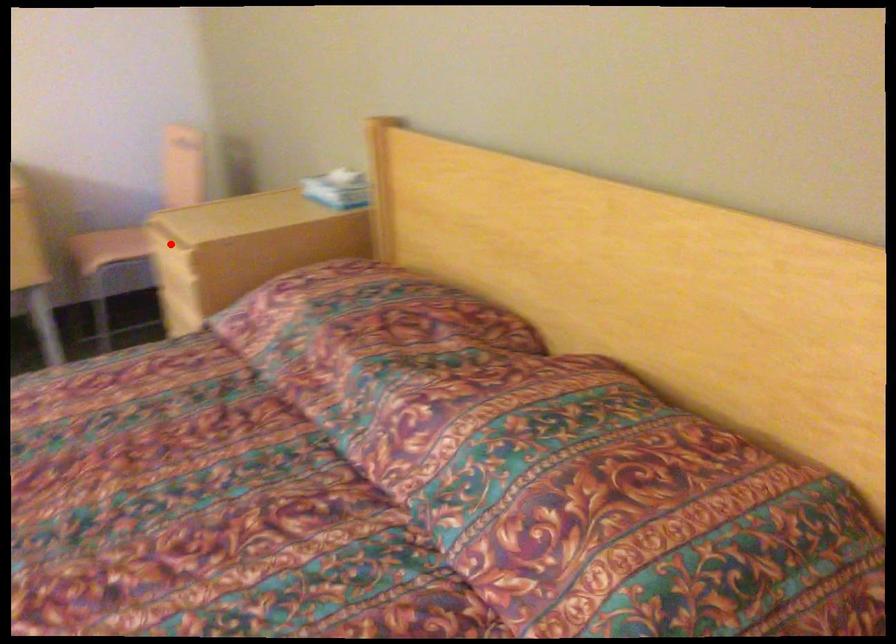
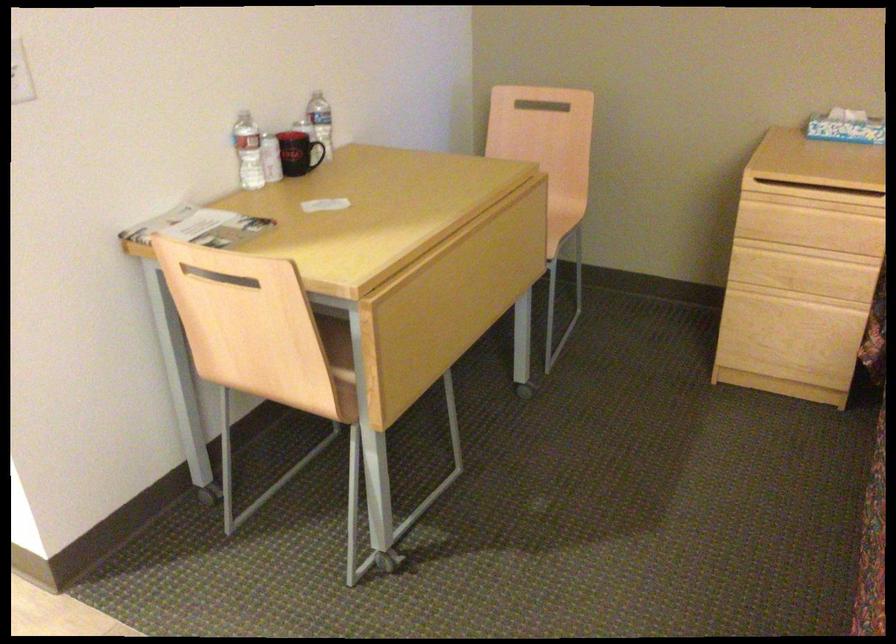
Where in the second image is the point corresponding to the highlighted location from the first image?

(814, 196)